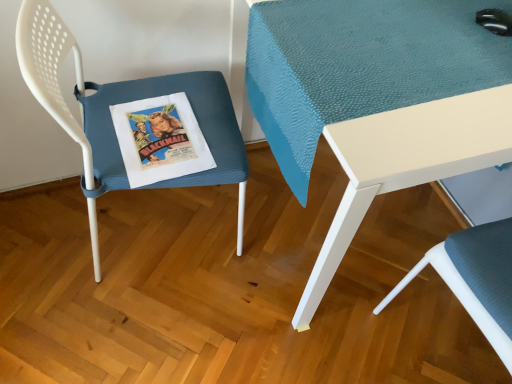
Find the location of a particular element. The width and height of the screenshot is (512, 384). free area in between blue textured cushion at left, which appears as the 2th chair when viewed from the right, and teal fabric table at center is located at coordinates (214, 305).